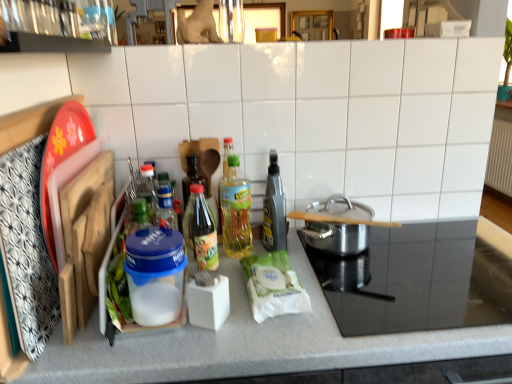
Find the location of a particular element. The height and width of the screenshot is (384, 512). free location in front of green glass bottle at center, the 3th bottle viewed from the right is located at coordinates (206, 331).